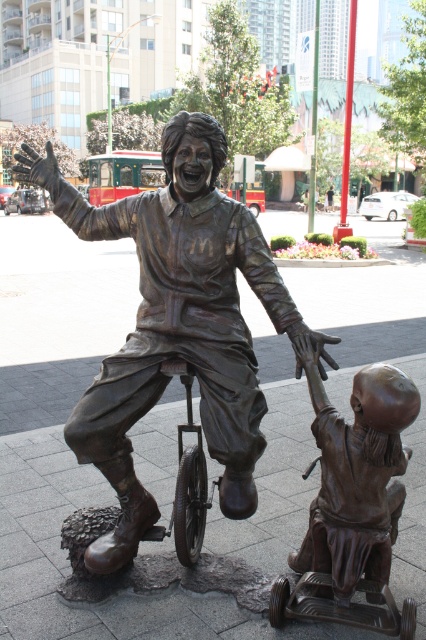
I want to click on bronze statue at center, so click(178, 323).

Does bronze statue at center have a lesser width compared to bronze baby at lower right?

No.

Who is more forward, (245, 460) or (367, 429)?

Point (367, 429)

The width and height of the screenshot is (426, 640). Identify the location of bronze statue at center. (178, 323).